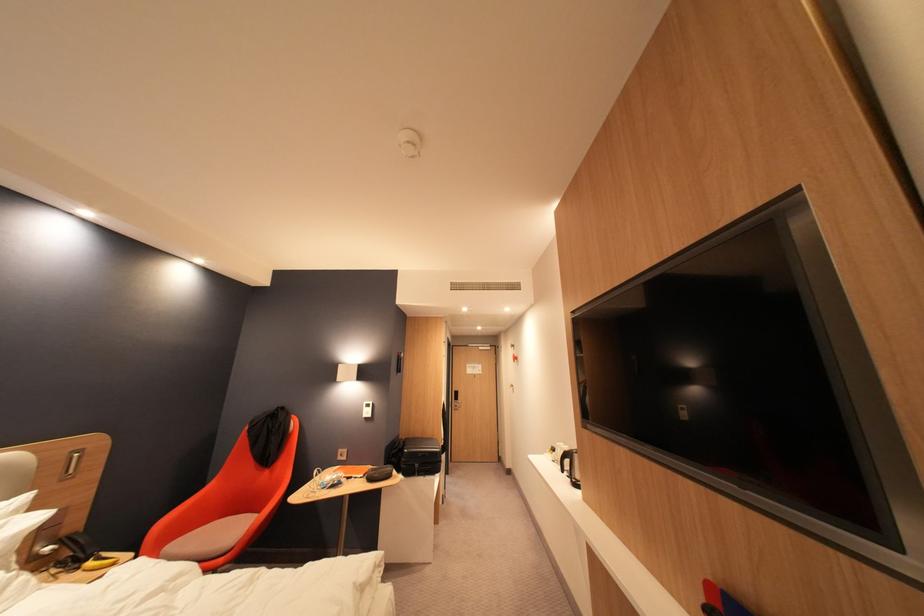
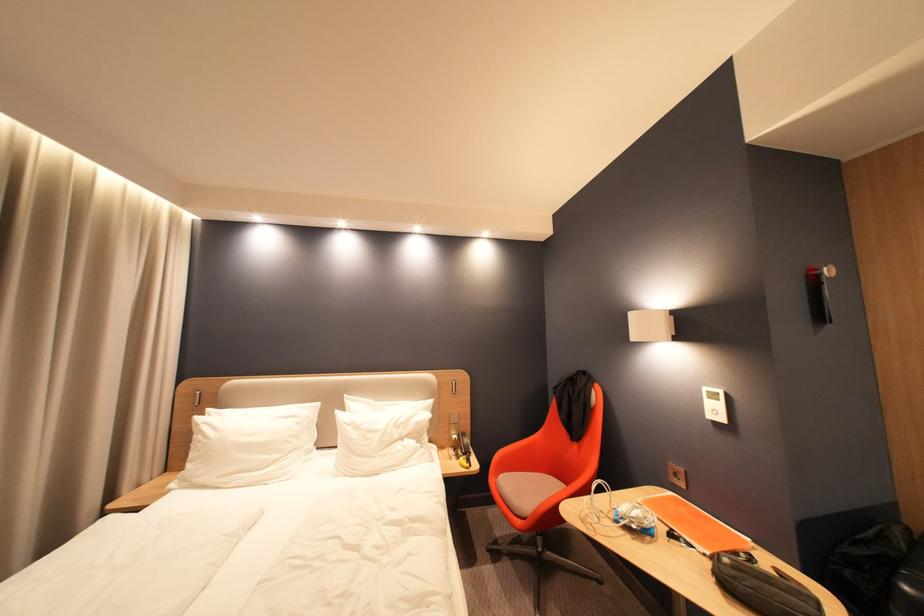
Locate, in the second image, the point that corresponds to (x=378, y=414) in the first image.

(724, 413)